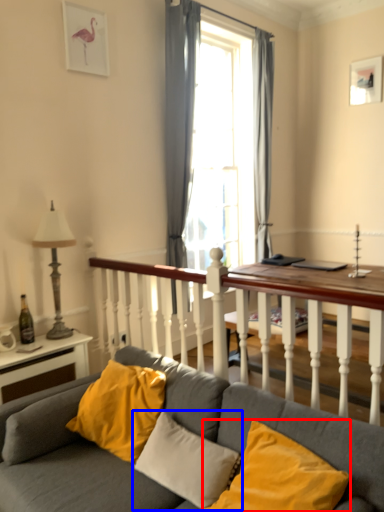
Question: Among these objects, which one is nearest to the camera, pillow (highlighted by a red box) or pillow (highlighted by a blue box)?

Choices:
 (A) pillow
 (B) pillow

Answer: (A)